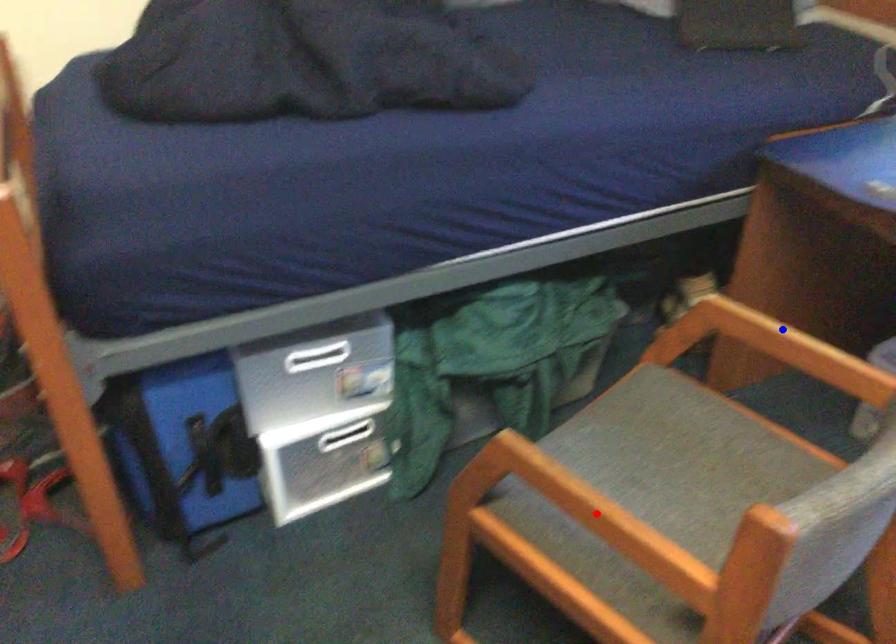
Question: In the image, two points are highlighted. Which point is nearer to the camera? Reply with the corresponding letter.

Choices:
 (A) blue point
 (B) red point

Answer: (B)